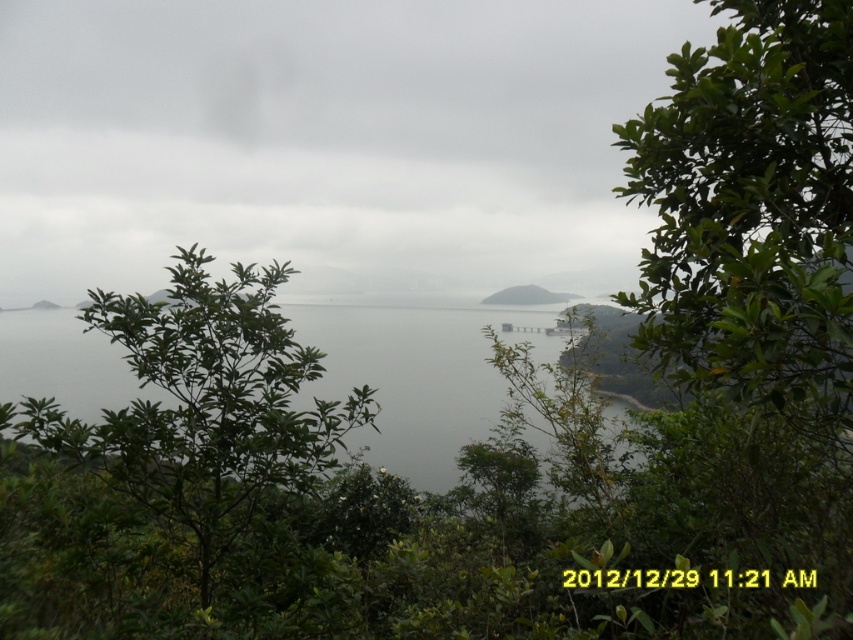
Question: In this image, where is green leafy tree at right located relative to gray water at center?

Choices:
 (A) above
 (B) below

Answer: (A)

Question: Where is green leafy tree at right located in relation to gray water at center in the image?

Choices:
 (A) below
 (B) above

Answer: (B)

Question: Which object is closer to the camera taking this photo?

Choices:
 (A) gray water at center
 (B) green leafy tree at right

Answer: (B)

Question: Which object is farther from the camera taking this photo?

Choices:
 (A) green leafy tree at right
 (B) green leafy tree at center
 (C) gray water at center

Answer: (C)

Question: In this image, where is green leafy tree at right located relative to green leafy tree at center?

Choices:
 (A) below
 (B) above

Answer: (B)

Question: Estimate the real-world distances between objects in this image. Which object is closer to the green leafy tree at center?

Choices:
 (A) green leafy tree at right
 (B) gray water at center

Answer: (A)